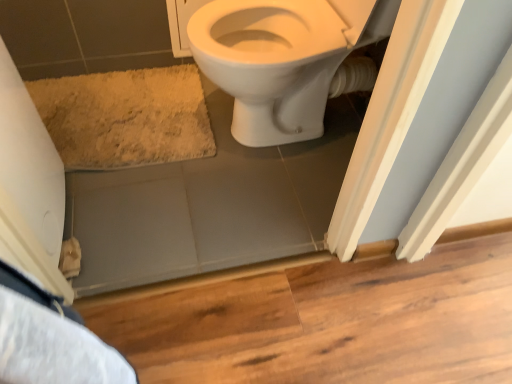
Where is `white glossy toilet at upper center`? The image size is (512, 384). white glossy toilet at upper center is located at coordinates (270, 64).

From the picture: Measure the distance between white glossy toilet at upper center and camera.

The depth of white glossy toilet at upper center is 3.57 feet.

What is the approximate width of white glossy toilet at upper center?

24.19 inches.

The width and height of the screenshot is (512, 384). What do you see at coordinates (270, 64) in the screenshot?
I see `white glossy toilet at upper center` at bounding box center [270, 64].

What is the approximate height of white glossy toilet at upper center?

white glossy toilet at upper center is 22.86 inches tall.

In order to face beige shaggy bath mat at lower left, should I rotate leftwards or rightwards?

Turn left by 19.639 degrees to look at beige shaggy bath mat at lower left.

At what (x,y) coordinates should I click in order to perform the action: click on beige shaggy bath mat at lower left. Please return your answer as a coordinate pair (x, y). This screenshot has width=512, height=384. Looking at the image, I should click on (125, 117).

What do you see at coordinates (125, 117) in the screenshot? I see `beige shaggy bath mat at lower left` at bounding box center [125, 117].

You are a GUI agent. You are given a task and a screenshot of the screen. Output one action in this format:
    pyautogui.click(x=<x>, y=<y>)
    Task: Click on the white glossy toilet at upper center
    The width and height of the screenshot is (512, 384).
    Given the screenshot: What is the action you would take?
    pyautogui.click(x=270, y=64)

Which is more to the left, white glossy toilet at upper center or beige shaggy bath mat at lower left?

beige shaggy bath mat at lower left.

Which object is further away from the camera, white glossy toilet at upper center or beige shaggy bath mat at lower left?

beige shaggy bath mat at lower left is more distant.

From the picture: Which point is more distant from viewer, [289,132] or [120,155]?

The point [289,132] is more distant.

From the image's perspective, would you say white glossy toilet at upper center is shown under beige shaggy bath mat at lower left?

No, from the image's perspective, white glossy toilet at upper center is not beneath beige shaggy bath mat at lower left.

From a real-world perspective, does white glossy toilet at upper center sit lower than beige shaggy bath mat at lower left?

No.

Considering the relative sizes of white glossy toilet at upper center and beige shaggy bath mat at lower left in the image provided, is white glossy toilet at upper center wider than beige shaggy bath mat at lower left?

Indeed, white glossy toilet at upper center has a greater width compared to beige shaggy bath mat at lower left.

Which of these two, white glossy toilet at upper center or beige shaggy bath mat at lower left, stands shorter?

beige shaggy bath mat at lower left.

Can you confirm if white glossy toilet at upper center is smaller than beige shaggy bath mat at lower left?

No.

Is white glossy toilet at upper center not within beige shaggy bath mat at lower left?

That's correct, white glossy toilet at upper center is outside of beige shaggy bath mat at lower left.

Is white glossy toilet at upper center with beige shaggy bath mat at lower left?

No, white glossy toilet at upper center is not next to beige shaggy bath mat at lower left.

Based on the photo, is white glossy toilet at upper center positioned with its back to beige shaggy bath mat at lower left?

No, white glossy toilet at upper center is not facing the opposite direction of beige shaggy bath mat at lower left.

Can you tell me how much white glossy toilet at upper center and beige shaggy bath mat at lower left differ in facing direction?

The angle between the facing direction of white glossy toilet at upper center and the facing direction of beige shaggy bath mat at lower left is 94.5 degrees.

In the image, there is a white glossy toilet at upper center. Identify the location of bath mat below it (from a real-world perspective). This screenshot has width=512, height=384. click(x=125, y=117).

Which is more to the right, beige shaggy bath mat at lower left or white glossy toilet at upper center?

Positioned to the right is white glossy toilet at upper center.

Considering the positions of objects beige shaggy bath mat at lower left and white glossy toilet at upper center in the image provided, who is behind, beige shaggy bath mat at lower left or white glossy toilet at upper center?

beige shaggy bath mat at lower left is further away from the camera.

Is point (154, 72) positioned behind point (204, 18)?

That is True.

From the image's perspective, between beige shaggy bath mat at lower left and white glossy toilet at upper center, who is located below?

beige shaggy bath mat at lower left appears lower in the image.

From a real-world perspective, which object stands above the other?

white glossy toilet at upper center is physically above.

Is beige shaggy bath mat at lower left thinner than white glossy toilet at upper center?

Correct, the width of beige shaggy bath mat at lower left is less than that of white glossy toilet at upper center.

Can you confirm if beige shaggy bath mat at lower left is shorter than white glossy toilet at upper center?

Yes.

Which of these two, beige shaggy bath mat at lower left or white glossy toilet at upper center, is smaller?

With smaller size is beige shaggy bath mat at lower left.

Is beige shaggy bath mat at lower left situated inside white glossy toilet at upper center or outside?

beige shaggy bath mat at lower left is spatially situated outside white glossy toilet at upper center.

Is beige shaggy bath mat at lower left placed right next to white glossy toilet at upper center?

No, beige shaggy bath mat at lower left is not next to white glossy toilet at upper center.

Is beige shaggy bath mat at lower left facing towards white glossy toilet at upper center?

No, beige shaggy bath mat at lower left is not aimed at white glossy toilet at upper center.

Can you tell me how much beige shaggy bath mat at lower left and white glossy toilet at upper center differ in facing direction?

94.5 degrees separate the facing orientations of beige shaggy bath mat at lower left and white glossy toilet at upper center.

Measure the distance between beige shaggy bath mat at lower left and white glossy toilet at upper center.

beige shaggy bath mat at lower left is 14.77 inches away from white glossy toilet at upper center.

You are a GUI agent. You are given a task and a screenshot of the screen. Output one action in this format:
    pyautogui.click(x=<x>, y=<y>)
    Task: Click on the bidet in front of the beige shaggy bath mat at lower left
    This screenshot has width=512, height=384.
    Given the screenshot: What is the action you would take?
    pyautogui.click(x=270, y=64)

In the image, there is a white glossy toilet at upper center. Identify the location of bath mat below it (from a real-world perspective). The image size is (512, 384). (125, 117).

At what (x,y) coordinates should I click in order to perform the action: click on bidet on the right of beige shaggy bath mat at lower left. Please return your answer as a coordinate pair (x, y). Looking at the image, I should click on (270, 64).